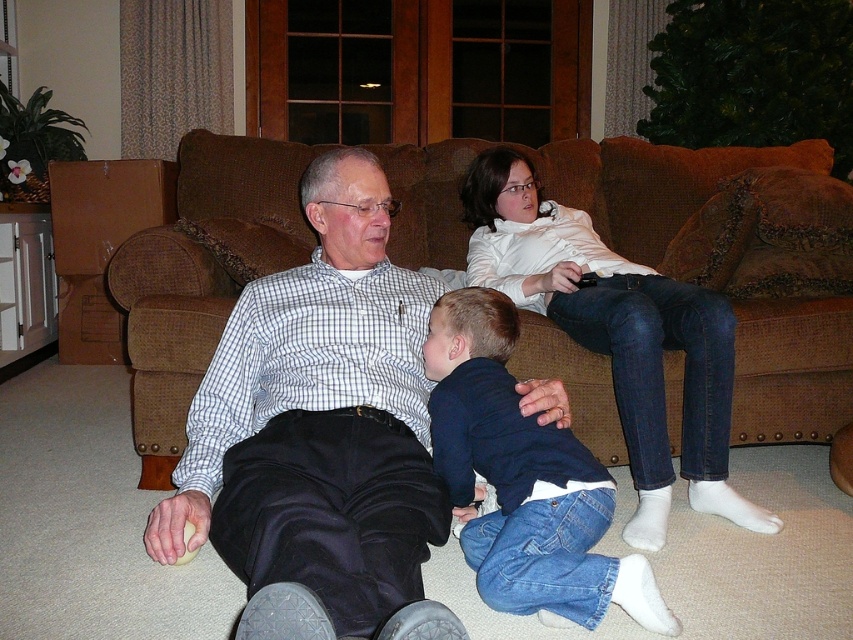
Which is above, brown fabric couch at center or dark blue denim jeans at lower center?

Positioned higher is brown fabric couch at center.

Can you confirm if brown fabric couch at center is shorter than dark blue denim jeans at lower center?

No.

Between point (207, 346) and point (509, 508), which one is positioned behind?

The point (207, 346) is behind.

I want to click on brown fabric couch at center, so click(x=201, y=275).

Who is more forward, [148,477] or [492,243]?

Point [148,477] is in front.

Does point (537, 356) come farther from viewer compared to point (485, 186)?

No, it is not.

The image size is (853, 640). I want to click on brown fabric couch at center, so click(201, 275).

Does white matte shirt at upper center appear on the right side of dark blue denim jeans at lower center?

Indeed, white matte shirt at upper center is positioned on the right side of dark blue denim jeans at lower center.

Which is behind, point (714, 438) or point (457, 449)?

The point (714, 438) is more distant.

What do you see at coordinates (616, 336) in the screenshot?
I see `white matte shirt at upper center` at bounding box center [616, 336].

Locate an element on the screen. The width and height of the screenshot is (853, 640). white matte shirt at upper center is located at coordinates (616, 336).